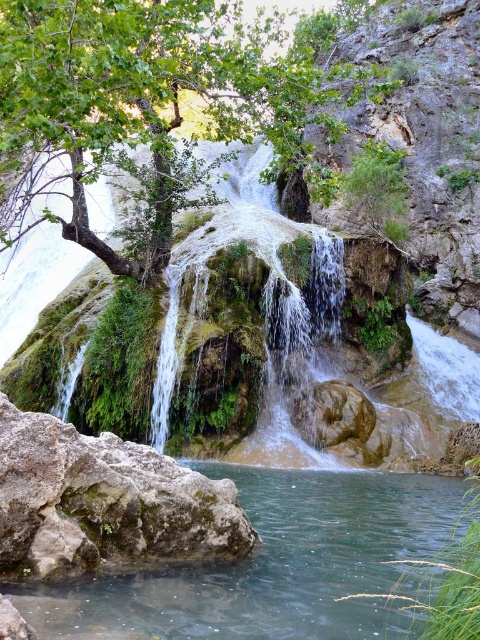
You are standing at the base of the waterfall and want to take a photo of both the green leafy tree at upper center and the clear water at rock left. Which object should you focus on first if you want to capture both in a single frame without moving your camera?

You should focus on the green leafy tree at upper center first because it is taller than the clear water at rock left, so adjusting the camera angle to include its height will naturally include the lower positioned clear water at rock left in the frame.

Looking at this image, you are a hiker standing at the base of the waterfall. You want to take a photo of the green leafy tree at upper center and the white frothy water at center in the same frame. Your camera can capture a maximum distance of 5 meters between the nearest and farthest objects. Will you be able to include both in your photo?

The distance between the green leafy tree at upper center and the white frothy water at center is 5.51 meters, which exceeds the camera maximum range of 5 meters. Therefore, you cannot capture both in the same frame.

You are standing at the base of the waterfall and want to reach the two points marked in the scene. Which point, point (218, 112) or point (312, 580), is closer to you?

Point (218, 112) is closer to you because it is further to the viewer than point (312, 580).